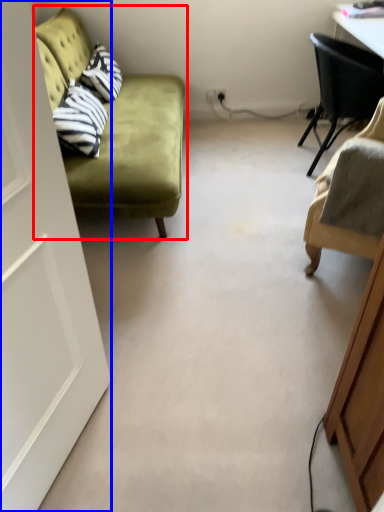
Question: Which point is further to the camera, studio couch (highlighted by a red box) or door (highlighted by a blue box)?

Choices:
 (A) studio couch
 (B) door

Answer: (A)